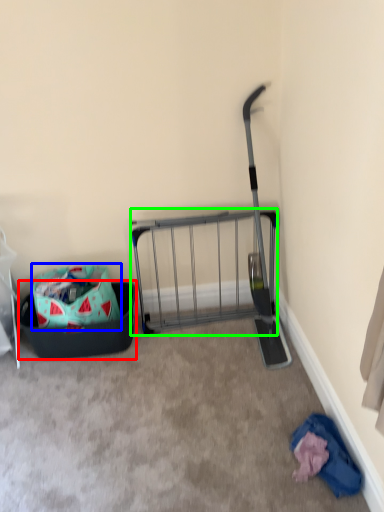
Question: Considering the real-world distances, which object is closest to laundry basket (highlighted by a red box)? bag (highlighted by a blue box) or cart (highlighted by a green box).

Choices:
 (A) bag
 (B) cart

Answer: (A)